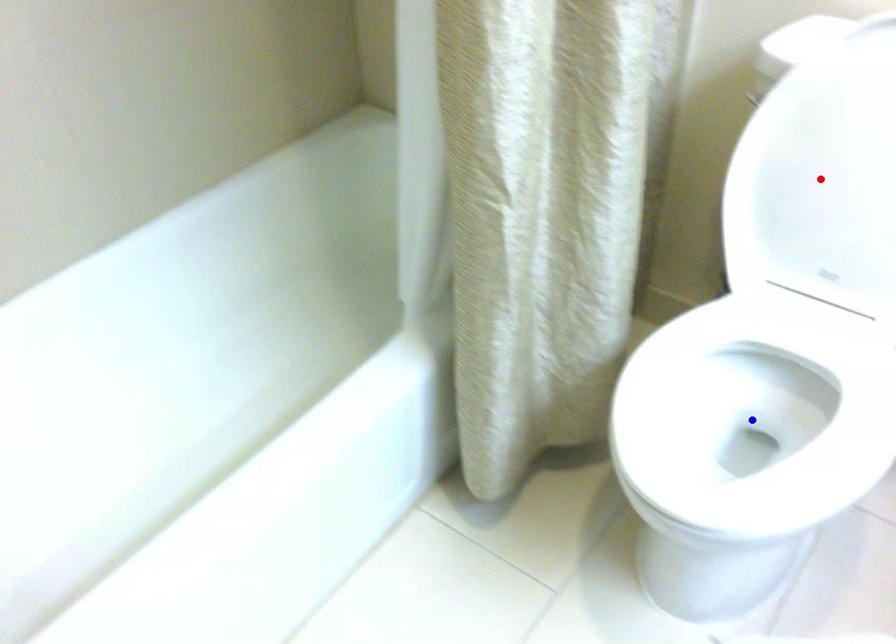
Question: In the image, two points are highlighted. Which point is nearer to the camera? Reply with the corresponding letter.

Choices:
 (A) blue point
 (B) red point

Answer: (B)